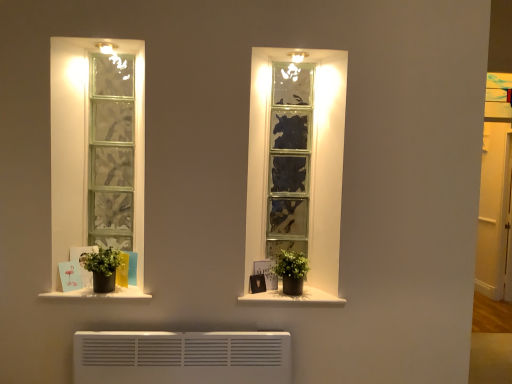
Question: Relative to green matte plant at right, which is the first houseplant from right to left, is matte black picture frame at center in front or behind?

Choices:
 (A) front
 (B) behind

Answer: (B)

Question: In terms of size, does matte black picture frame at center appear bigger or smaller than green matte plant at right, which appears as the second houseplant when viewed from the left?

Choices:
 (A) small
 (B) big

Answer: (A)

Question: Which of these objects is positioned closest to the green matte pot at left, which is the first houseplant in left-to-right order?

Choices:
 (A) white matte window sill at lower left, which ranks as the 2th window sill in right-to-left order
 (B) transparent glass door at right
 (C) matte black picture frame at center
 (D) white matte window sill at center, acting as the 2th window sill starting from the left
 (E) green matte plant at right, which is the first houseplant from right to left

Answer: (A)

Question: Estimate the real-world distances between objects in this image. Which object is farther from the transparent glass door at right?

Choices:
 (A) green matte pot at left, which ranks as the 2th houseplant in right-to-left order
 (B) white matte window sill at center, marked as the first window sill in a right-to-left arrangement
 (C) matte black picture frame at center
 (D) green matte plant at right, which is the first houseplant from right to left
 (E) white matte window sill at lower left, the 1th window sill in the left-to-right sequence

Answer: (E)